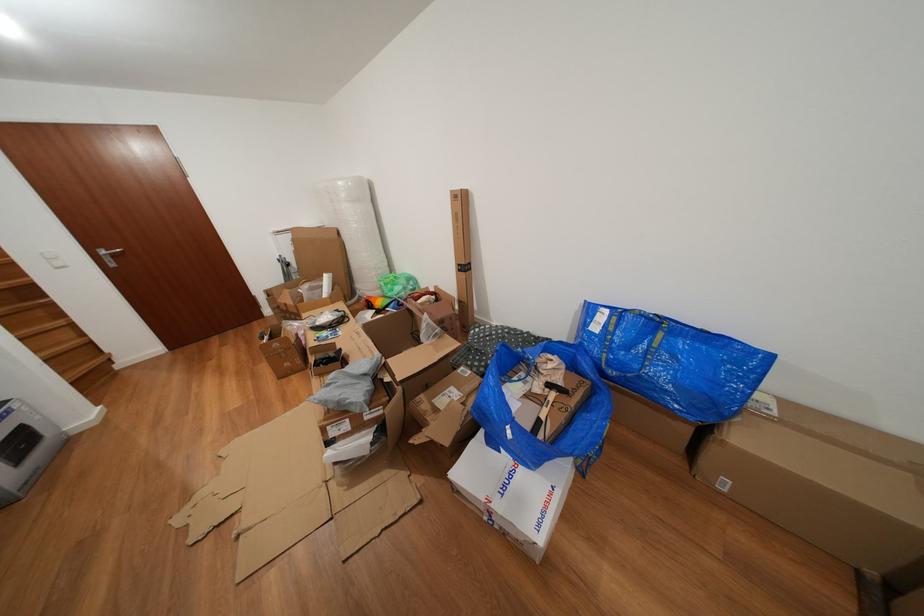
Image resolution: width=924 pixels, height=616 pixels. Find the location of `white light switch`. white light switch is located at coordinates (54, 259).